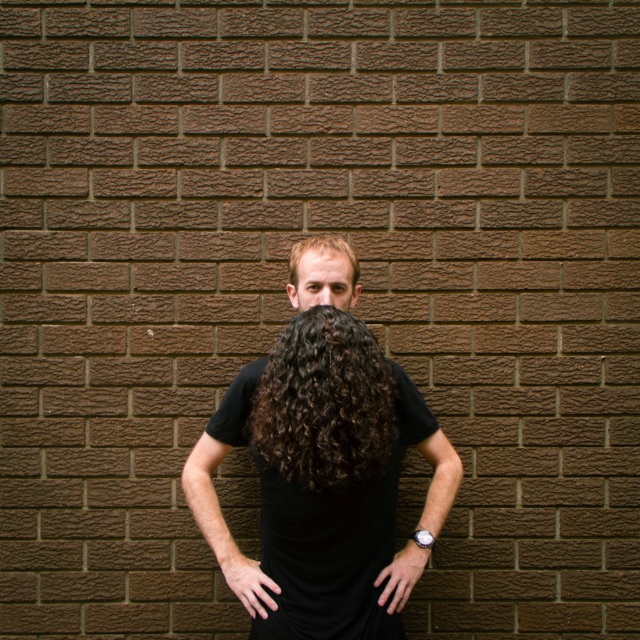
How far apart are black matte t-shirt at center and matte black face at center?

A distance of 13.43 inches exists between black matte t-shirt at center and matte black face at center.

Based on the photo, does black matte t-shirt at center have a smaller size compared to matte black face at center?

Incorrect, black matte t-shirt at center is not smaller in size than matte black face at center.

Which is behind, point (385, 396) or point (352, 285)?

Point (352, 285)

You are a GUI agent. You are given a task and a screenshot of the screen. Output one action in this format:
    pyautogui.click(x=<x>, y=<y>)
    Task: Click on the black matte t-shirt at center
    
    Given the screenshot: What is the action you would take?
    pyautogui.click(x=323, y=477)

Does black matte t-shirt at center have a greater height compared to dark curly hair at center?

Yes.

Which of these two, black matte t-shirt at center or dark curly hair at center, stands shorter?

dark curly hair at center is shorter.

Where is `black matte t-shirt at center`? black matte t-shirt at center is located at coordinates (323, 477).

Measure the distance between dark curly hair at center and matte black face at center.

dark curly hair at center and matte black face at center are 31.17 centimeters apart from each other.

Is dark curly hair at center shorter than matte black face at center?

No.

The width and height of the screenshot is (640, 640). Find the location of `dark curly hair at center`. dark curly hair at center is located at coordinates (324, 403).